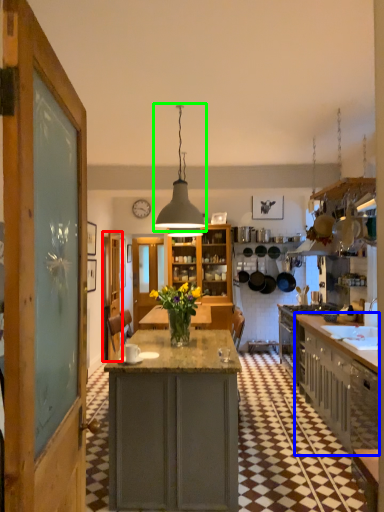
Question: Considering the real-world distances, which object is farthest from door (highlighted by a red box)? cabinetry (highlighted by a blue box) or light fixture (highlighted by a green box)?

Choices:
 (A) cabinetry
 (B) light fixture

Answer: (A)